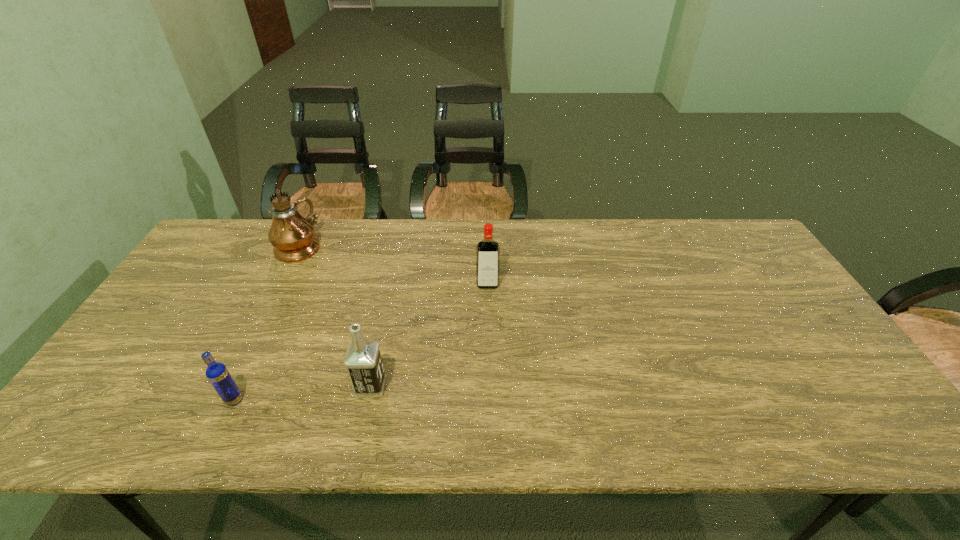
Where is `free location located on the right of the shortest vodka`? The height and width of the screenshot is (540, 960). free location located on the right of the shortest vodka is located at coordinates (416, 400).

In order to click on object located in the far edge section of the desktop in this screenshot , I will do `click(293, 237)`.

Where is `object that is positioned at the near edge`? object that is positioned at the near edge is located at coordinates (217, 373).

In the image, there is a desktop. What are the coordinates of `vacant area at the far edge` in the screenshot? It's located at (384, 222).

Find the location of a particular element. The image size is (960, 540). free region at the near edge of the desktop is located at coordinates (576, 441).

The height and width of the screenshot is (540, 960). In order to click on vacant point at the left edge in this screenshot , I will do `click(107, 397)`.

I want to click on free region at the near left corner, so click(x=133, y=408).

Locate an element on the screen. This screenshot has width=960, height=540. vacant space at the far right corner of the desktop is located at coordinates (697, 223).

Image resolution: width=960 pixels, height=540 pixels. In order to click on vacant area that lies between the third object from left to right and the shortest vodka in this screenshot , I will do `click(302, 393)`.

Locate an element on the screen. The height and width of the screenshot is (540, 960). free space between the tallest object and the rightmost vodka is located at coordinates click(393, 265).